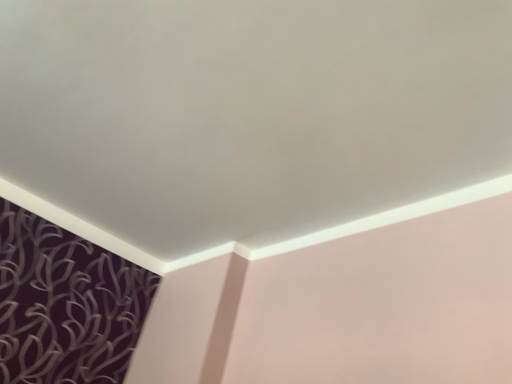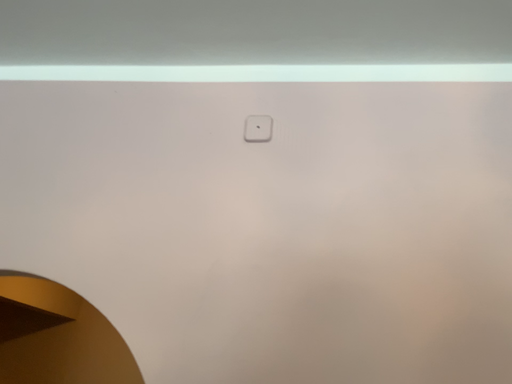
Question: Which way did the camera rotate in the video?

Choices:
 (A) rotated right
 (B) rotated left

Answer: (A)